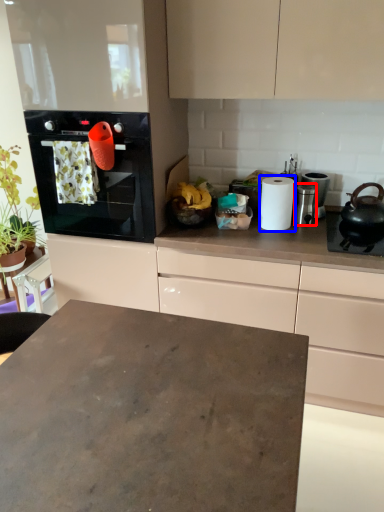
Question: Among these objects, which one is nearest to the camera, appliance (highlighted by a red box) or paper towel (highlighted by a blue box)?

Choices:
 (A) appliance
 (B) paper towel

Answer: (B)